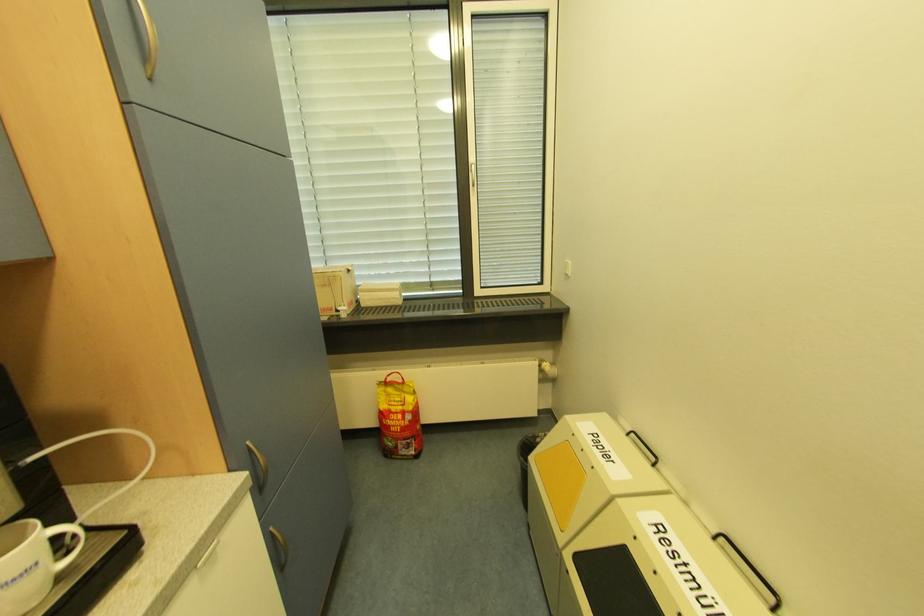
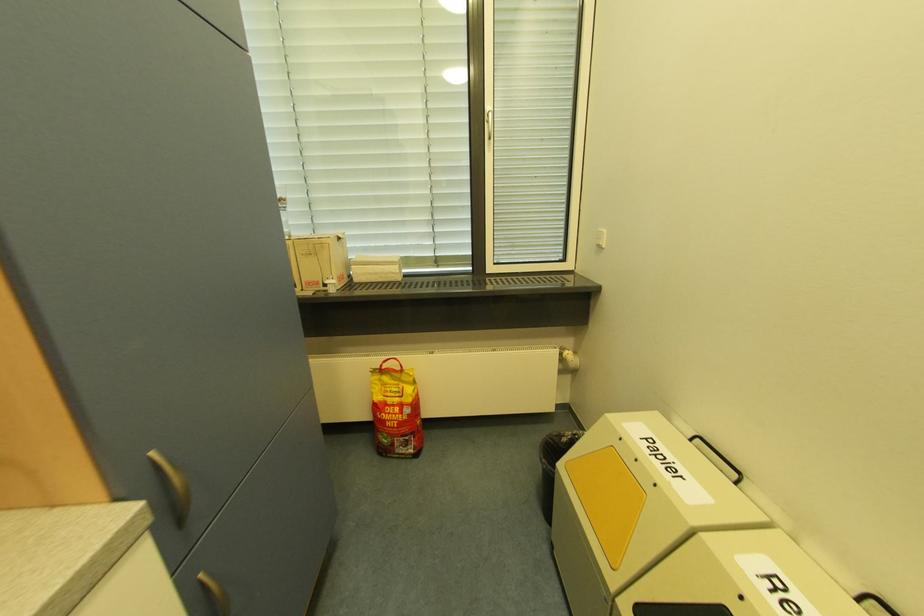
Question: Which direction would the cameraman need to move to produce the second image? Reply with the corresponding letter.

Choices:
 (A) Left
 (B) Right
 (C) Forward
 (D) Backward

Answer: (C)